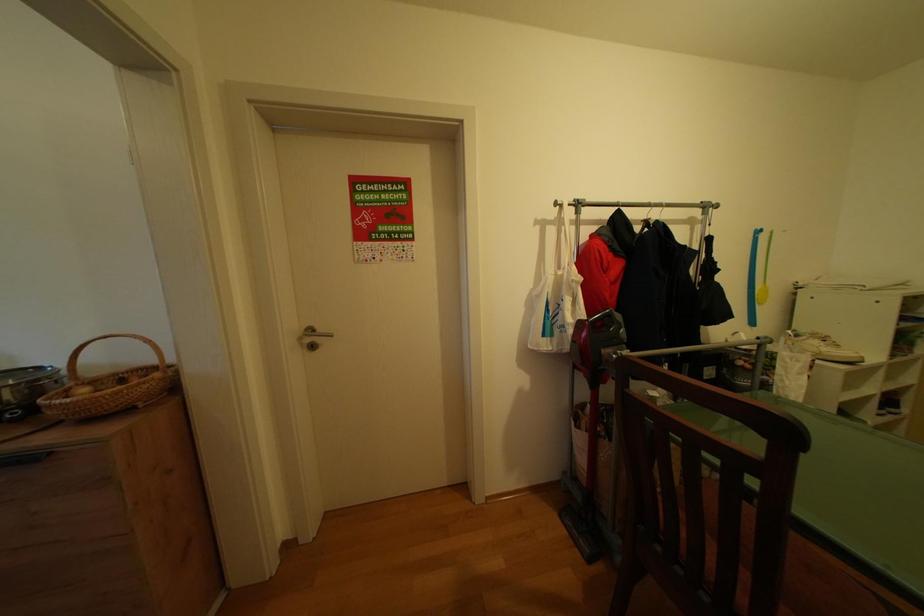
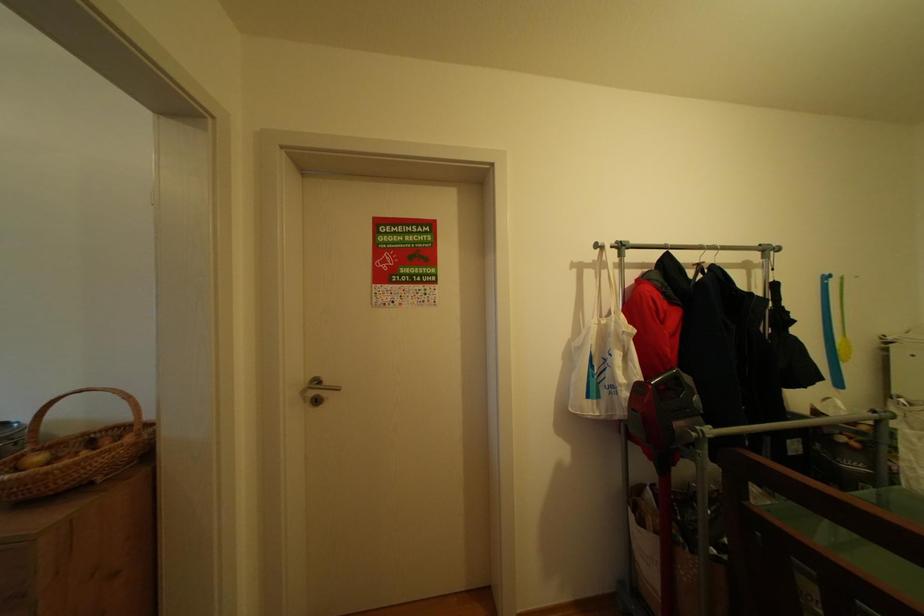
Question: The first image is from the beginning of the video and the second image is from the end. How did the camera likely rotate when shooting the video?

Choices:
 (A) Left
 (B) Right
 (C) Up
 (D) Down

Answer: (C)